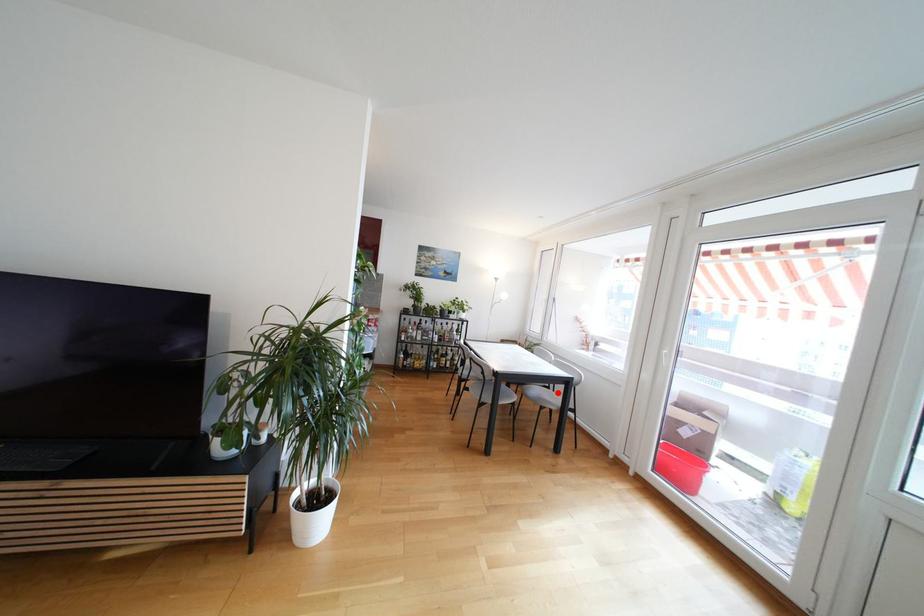
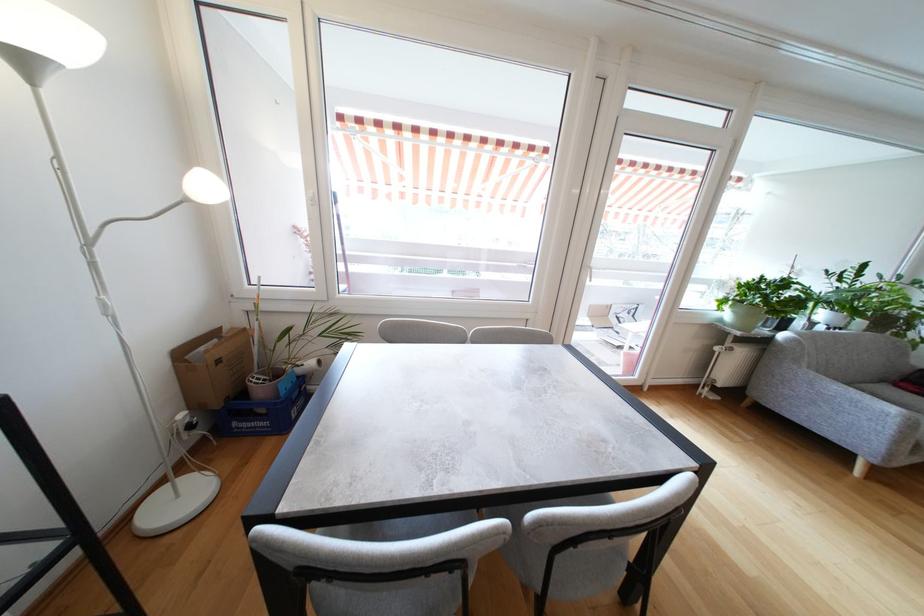
Question: I am providing you with two images of the same scene from different viewpoints. A red point is marked on the first image. Is the red point's position out of view in image 2?

Choices:
 (A) Yes
 (B) No

Answer: (A)